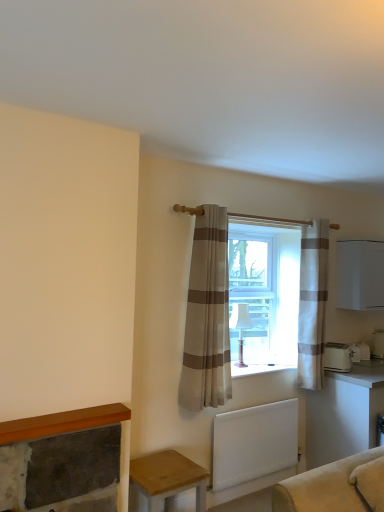
What is the approximate height of white glossy table at lower right, the second table from the left?

white glossy table at lower right, the second table from the left, is 36.13 inches in height.

Measure the distance between beige striped curtain at center, which is the second curtain in back-to-front order, and camera.

The depth of beige striped curtain at center, which is the second curtain in back-to-front order, is 9.05 feet.

Image resolution: width=384 pixels, height=512 pixels. Find the location of `wooden table at lower left, which is the first table in front-to-back order`. wooden table at lower left, which is the first table in front-to-back order is located at coordinates (168, 478).

The image size is (384, 512). What are the coordinates of `white striped curtain at center, the 1th curtain in the right-to-left sequence` in the screenshot? It's located at (312, 303).

At what (x,y) coordinates should I click in order to perform the action: click on white glossy table at lower right, which is the 1th table in back-to-front order. Please return your answer as a coordinate pair (x, y). This screenshot has width=384, height=512. Looking at the image, I should click on (x=344, y=413).

Would you say wooden table at lower left, which is the first table in front-to-back order, is part of white matte radiator at lower center's contents?

No, wooden table at lower left, which is the first table in front-to-back order, is not surrounded by white matte radiator at lower center.

What's the angular difference between white matte radiator at lower center and wooden table at lower left, arranged as the second table when viewed from the back,'s facing directions?

3.37 degrees separate the facing orientations of white matte radiator at lower center and wooden table at lower left, arranged as the second table when viewed from the back.

From a real-world perspective, who is located higher, white matte radiator at lower center or wooden table at lower left, marked as the second table in a right-to-left arrangement?

white matte radiator at lower center, from a real-world perspective.

Which of these two, white matte radiator at lower center or wooden table at lower left, placed as the first table when sorted from left to right, is bigger?

wooden table at lower left, placed as the first table when sorted from left to right, is bigger.

Which point is more forward, (x=141, y=464) or (x=254, y=463)?

The point (x=141, y=464) is closer.

Which is in front, wooden table at lower left, arranged as the second table when viewed from the back, or white matte radiator at lower center?

Positioned in front is wooden table at lower left, arranged as the second table when viewed from the back.

Choose the correct answer: Is wooden table at lower left, placed as the first table when sorted from left to right, inside white matte radiator at lower center or outside it?

wooden table at lower left, placed as the first table when sorted from left to right, lies outside white matte radiator at lower center.

From the image's perspective, which is below, wooden table at lower left, arranged as the second table when viewed from the back, or beige striped curtain at center, placed as the first curtain when sorted from left to right?

wooden table at lower left, arranged as the second table when viewed from the back, is shown below in the image.

From a real-world perspective, is wooden table at lower left, arranged as the second table when viewed from the back, below beige striped curtain at center, arranged as the first curtain when viewed from the front?

Indeed, from a real-world perspective, wooden table at lower left, arranged as the second table when viewed from the back, is positioned beneath beige striped curtain at center, arranged as the first curtain when viewed from the front.

Considering the sizes of objects wooden table at lower left, placed as the first table when sorted from left to right, and beige striped curtain at center, placed as the 2th curtain when sorted from right to left, in the image provided, who is smaller, wooden table at lower left, placed as the first table when sorted from left to right, or beige striped curtain at center, placed as the 2th curtain when sorted from right to left,?

wooden table at lower left, placed as the first table when sorted from left to right, is smaller.

Is wooden table at lower left, arranged as the second table when viewed from the back, far away from beige striped curtain at center, which is the second curtain in back-to-front order?

They are positioned close to each other.

Which point is more forward, (342,369) or (193,359)?

The point (193,359) is closer.

Is white plastic toaster at lower right, the second appliance when ordered from right to left, looking in the opposite direction of beige striped curtain at center, placed as the first curtain when sorted from left to right?

white plastic toaster at lower right, the second appliance when ordered from right to left, is not turned away from beige striped curtain at center, placed as the first curtain when sorted from left to right.

Looking at the image, does white plastic toaster at lower right, the second appliance when ordered from right to left, seem bigger or smaller compared to beige striped curtain at center, arranged as the first curtain when viewed from the front?

In the image, white plastic toaster at lower right, the second appliance when ordered from right to left, appears to be smaller than beige striped curtain at center, arranged as the first curtain when viewed from the front.

Would you say white plastic toaster at lower right, which ranks as the 1th appliance in front-to-back order, contains beige striped curtain at center, arranged as the first curtain when viewed from the front?

Definitely not — beige striped curtain at center, arranged as the first curtain when viewed from the front, is not inside white plastic toaster at lower right, which ranks as the 1th appliance in front-to-back order.

Can you confirm if white fabric lampshade at window is bigger than white plastic toaster at lower right, the second appliance when ordered from right to left?

Yes.

Is white fabric lampshade at window in front of or behind white plastic toaster at lower right, which ranks as the 1th appliance in front-to-back order, in the image?

Clearly, white fabric lampshade at window is in front of white plastic toaster at lower right, which ranks as the 1th appliance in front-to-back order.

Does white fabric lampshade at window appear on the left side of white plastic toaster at lower right, the second appliance when ordered from right to left?

Yes.

How many degrees apart are the facing directions of white fabric lampshade at window and white plastic toaster at lower right, the 2th appliance in the back-to-front sequence?

There is a 29.6-degree angle between the facing directions of white fabric lampshade at window and white plastic toaster at lower right, the 2th appliance in the back-to-front sequence.

From the image's perspective, is beige striped curtain at center, arranged as the first curtain when viewed from the front, beneath white plastic toaster at right, which appears as the 1th appliance when viewed from the back?

Actually, beige striped curtain at center, arranged as the first curtain when viewed from the front, appears above white plastic toaster at right, which appears as the 1th appliance when viewed from the back, in the image.

Is beige striped curtain at center, arranged as the first curtain when viewed from the front, not within white plastic toaster at right, which is counted as the 2th appliance, starting from the left?

That's correct, beige striped curtain at center, arranged as the first curtain when viewed from the front, is outside of white plastic toaster at right, which is counted as the 2th appliance, starting from the left.

Find the location of a particular element. appliance that is the 1st object located below the beige striped curtain at center, placed as the 2th curtain when sorted from right to left (from the image's perspective) is located at coordinates (377, 344).

Is white glossy table at lower right, which is the 2th table from front to back, positioned beyond the bounds of white fabric lampshade at window?

Absolutely, white glossy table at lower right, which is the 2th table from front to back, is external to white fabric lampshade at window.

Are white glossy table at lower right, which is the 1th table in back-to-front order, and white fabric lampshade at window making contact?

There is a gap between white glossy table at lower right, which is the 1th table in back-to-front order, and white fabric lampshade at window.

Locate an element on the screen. The height and width of the screenshot is (512, 384). the 1st table below the white fabric lampshade at window (from the image's perspective) is located at coordinates (344, 413).

Locate an element on the screen. The image size is (384, 512). table on the left side of white matte radiator at lower center is located at coordinates (168, 478).

In the image, there is a white matte radiator at lower center. Identify the location of table below it (from the image's perspective). The image size is (384, 512). (168, 478).

Which object lies nearer to the anchor point white striped curtain at center, the 2th curtain from the front, white matte radiator at lower center or wooden table at lower left, placed as the first table when sorted from left to right?

white matte radiator at lower center is closer to white striped curtain at center, the 2th curtain from the front.

From the image, which object appears to be nearer to white plastic toaster at right, placed as the second appliance when sorted from front to back, white matte cabinet at right or beige striped curtain at center, placed as the first curtain when sorted from left to right?

white matte cabinet at right is closer to white plastic toaster at right, placed as the second appliance when sorted from front to back.

Looking at the image, which one is located closer to beige striped curtain at center, placed as the first curtain when sorted from left to right, white glossy table at lower right, which is the 1th table in back-to-front order, or white fabric lampshade at window?

white fabric lampshade at window lies closer to beige striped curtain at center, placed as the first curtain when sorted from left to right, than the other object.

From the image, which object appears to be nearer to beige striped curtain at center, which is the second curtain in back-to-front order, white plastic toaster at lower right, which ranks as the 1th appliance in front-to-back order, or white plastic toaster at right, which is counted as the 2th appliance, starting from the left?

Based on the image, white plastic toaster at lower right, which ranks as the 1th appliance in front-to-back order, appears to be nearer to beige striped curtain at center, which is the second curtain in back-to-front order.

Which object lies further to the anchor point wooden table at lower left, marked as the second table in a right-to-left arrangement, beige striped curtain at center, placed as the 2th curtain when sorted from right to left, or white plastic toaster at right, which appears as the 1th appliance when viewed from the back?

white plastic toaster at right, which appears as the 1th appliance when viewed from the back, lies further to wooden table at lower left, marked as the second table in a right-to-left arrangement, than the other object.

Estimate the real-world distances between objects in this image. Which object is closer to white fabric lampshade at window, white matte radiator at lower center or beige striped curtain at center, which is the second curtain in back-to-front order?

The object closer to white fabric lampshade at window is white matte radiator at lower center.

Considering their positions, is white fabric lampshade at window positioned further to white matte cabinet at right than white plastic toaster at right, placed as the second appliance when sorted from front to back?

white fabric lampshade at window is positioned further to the anchor white matte cabinet at right.

Estimate the real-world distances between objects in this image. Which object is further from white plastic toaster at right, which is counted as the 2th appliance, starting from the left, beige striped curtain at center, which is the second curtain in back-to-front order, or white matte cabinet at right?

Among the two, beige striped curtain at center, which is the second curtain in back-to-front order, is located further to white plastic toaster at right, which is counted as the 2th appliance, starting from the left.

You are a GUI agent. You are given a task and a screenshot of the screen. Output one action in this format:
    pyautogui.click(x=<x>, y=<y>)
    Task: Click on the appliance between beige striped curtain at center, placed as the 2th curtain when sorted from right to left, and white glossy table at lower right, which is the 2th table from front to back
    
    Given the screenshot: What is the action you would take?
    click(337, 357)

This screenshot has height=512, width=384. What are the coordinates of `radiator between beige striped curtain at center, placed as the 2th curtain when sorted from right to left, and white matte cabinet at right, in the horizontal direction` in the screenshot? It's located at (254, 442).

Locate an element on the screen. table between white fabric lampshade at window and white plastic toaster at right, positioned as the first appliance in right-to-left order is located at coordinates (344, 413).

In order to click on radiator located between beige striped curtain at center, which is the second curtain in back-to-front order, and white plastic toaster at lower right, the second appliance when ordered from right to left, in the left-right direction in this screenshot , I will do `click(254, 442)`.